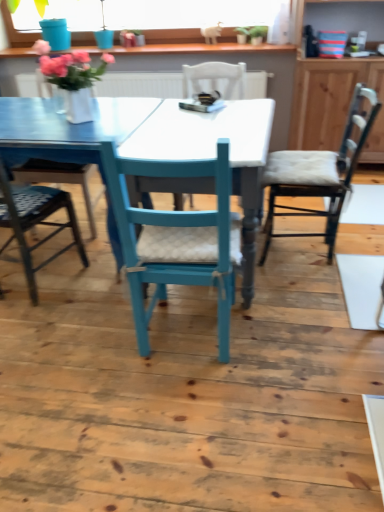
Question: Would you say metallic silver chair at left, which is counted as the first chair, starting from the left, is to the left or to the right of green matte plant at upper center in the picture?

Choices:
 (A) right
 (B) left

Answer: (B)

Question: Is metallic silver chair at left, the third chair when ordered from right to left, taller or shorter than green matte plant at upper center?

Choices:
 (A) short
 (B) tall

Answer: (B)

Question: Which object is positioned farthest from the wooden textured chair at right, which is the first chair in right-to-left order?

Choices:
 (A) teal painted wood chair at center, which is the 2th chair from right to left
 (B) wooden cabinet at right
 (C) matte blue swivel chair at left
 (D) metallic silver chair at left, which is counted as the first chair, starting from the left
 (E) green matte plant at upper center

Answer: (E)

Question: Which object is positioned farthest from the metallic silver chair at left, which is counted as the first chair, starting from the left?

Choices:
 (A) teal painted wood chair at center, acting as the second chair starting from the left
 (B) matte blue swivel chair at left
 (C) wooden textured chair at right, which appears as the third chair when viewed from the left
 (D) wooden cabinet at right
 (E) green matte plant at upper center

Answer: (E)